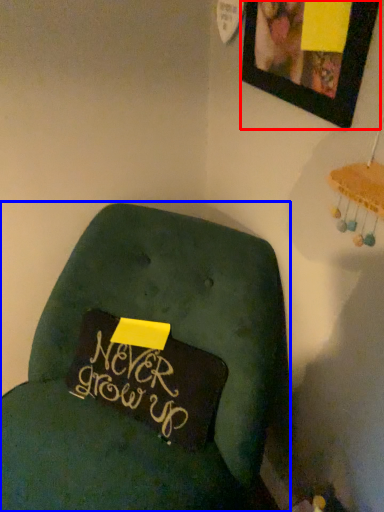
Question: Which object appears closest to the camera in this image, picture frame (highlighted by a red box) or furniture (highlighted by a blue box)?

Choices:
 (A) picture frame
 (B) furniture

Answer: (B)